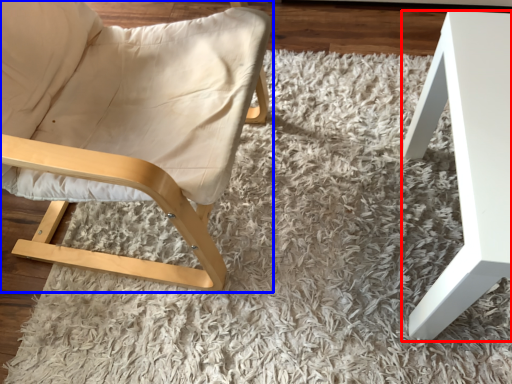
Question: Among these objects, which one is nearest to the camera, table (highlighted by a red box) or chair (highlighted by a blue box)?

Choices:
 (A) table
 (B) chair

Answer: (B)